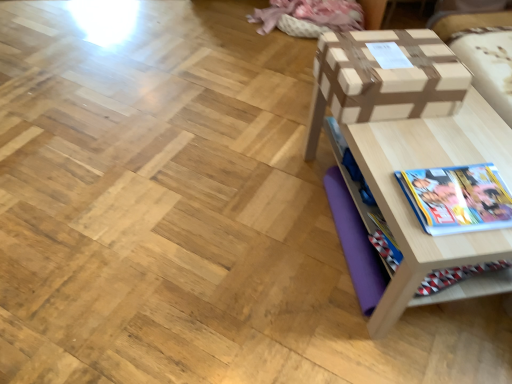
Question: From the image's perspective, relative to wooden table at right, is hardcover book at lower right above or below?

Choices:
 (A) above
 (B) below

Answer: (B)

Question: Is point (468, 205) positioned closer to the camera than point (435, 49)?

Choices:
 (A) closer
 (B) farther

Answer: (A)

Question: Considering the real-world distances, which object is closest to the wooden table at right?

Choices:
 (A) hardcover book at lower right
 (B) brown cardboard box at upper right

Answer: (B)

Question: Considering the real-world distances, which object is closest to the wooden table at right?

Choices:
 (A) hardcover book at lower right
 (B) brown cardboard box at upper right

Answer: (B)